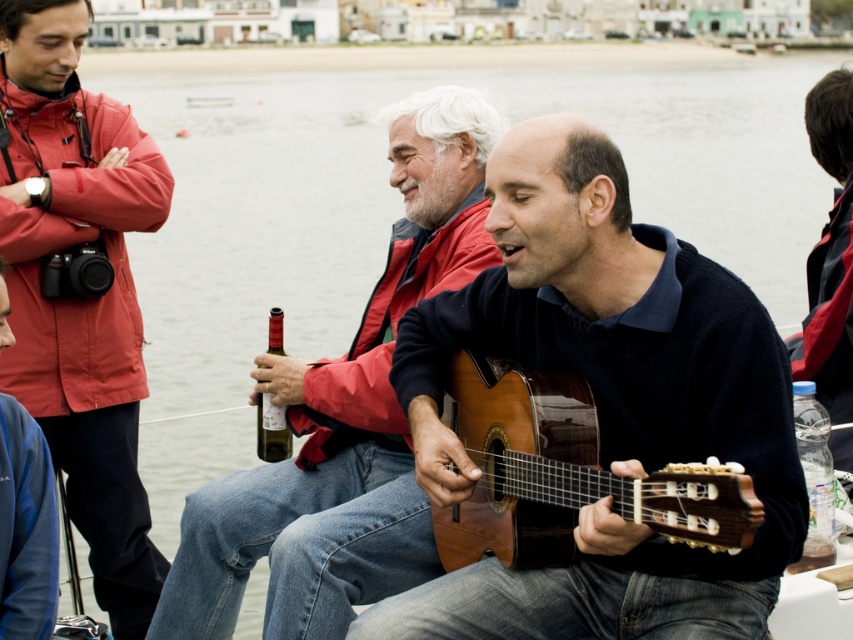
Question: Which point appears farthest from the camera in this image?

Choices:
 (A) (264, 442)
 (B) (419, 182)
 (C) (838, 193)
 (D) (68, 241)

Answer: (C)

Question: Can you confirm if matte brown guitar at center is smaller than matte black camera at left?

Choices:
 (A) no
 (B) yes

Answer: (A)

Question: Is wooden acoustic guitar at center below green glass bottle at center?

Choices:
 (A) no
 (B) yes

Answer: (A)

Question: Does wooden acoustic guitar at center appear under matte brown guitar at center?

Choices:
 (A) yes
 (B) no

Answer: (A)

Question: Which point is farther to the camera?

Choices:
 (A) wooden acoustic guitar at center
 (B) matte black camera at left

Answer: (B)

Question: Among these objects, which one is nearest to the camera?

Choices:
 (A) green glass bottle at center
 (B) matte brown guitar at center
 (C) brown wooden guitar at center

Answer: (C)